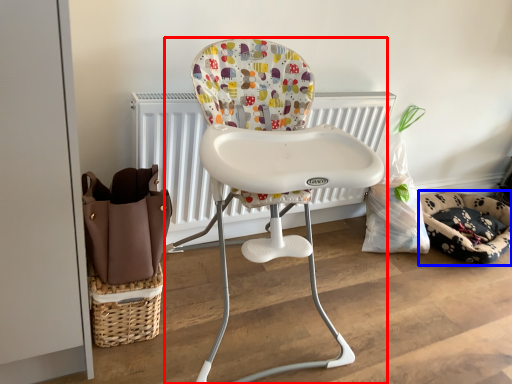
Question: Among these objects, which one is farthest to the camera, chair (highlighted by a red box) or dog bed (highlighted by a blue box)?

Choices:
 (A) chair
 (B) dog bed

Answer: (B)